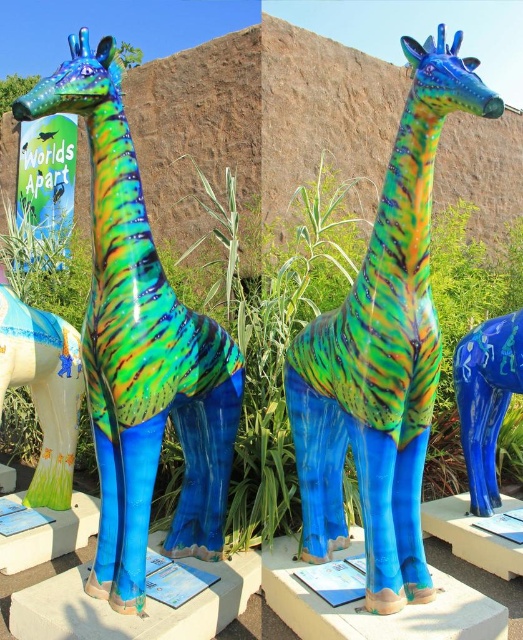
Which is more to the left, matte ceramic elephant at lower left or blue glossy giraffe at lower right?

From the viewer's perspective, matte ceramic elephant at lower left appears more on the left side.

Based on the photo, can you confirm if matte ceramic elephant at lower left is positioned to the right of blue glossy giraffe at lower right?

No, matte ceramic elephant at lower left is not to the right of blue glossy giraffe at lower right.

Which is behind, point (76, 339) or point (470, 381)?

The point (76, 339) is more distant.

You are a GUI agent. You are given a task and a screenshot of the screen. Output one action in this format:
    pyautogui.click(x=<x>, y=<y>)
    Task: Click on the matte ceramic elephant at lower left
    
    Given the screenshot: What is the action you would take?
    pyautogui.click(x=43, y=388)

Which is below, glossy ceramic giraffe at center or blue glossy giraffe at lower right?

blue glossy giraffe at lower right is below.

The width and height of the screenshot is (523, 640). Find the location of `glossy ceramic giraffe at center`. glossy ceramic giraffe at center is located at coordinates (382, 353).

Who is more forward, (x=343, y=540) or (x=494, y=326)?

Positioned in front is point (x=343, y=540).

The height and width of the screenshot is (640, 523). Identify the location of glossy ceramic giraffe at center. (382, 353).

Can you confirm if shiny ceramic giraffe at center is positioned to the right of blue glossy giraffe at lower right?

No, shiny ceramic giraffe at center is not to the right of blue glossy giraffe at lower right.

Does point (116, 387) lie behind point (483, 342)?

No, it is not.

This screenshot has height=640, width=523. What are the coordinates of `shiny ceramic giraffe at center` in the screenshot? It's located at (141, 349).